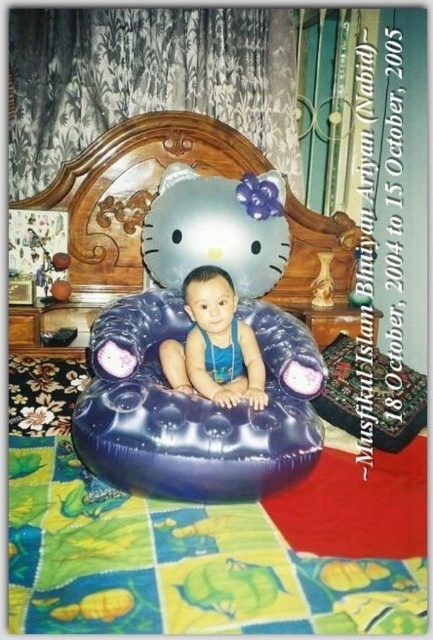
Is blue rubber bean bag chair at center bigger than blue rubber baby at center?

Indeed, blue rubber bean bag chair at center has a larger size compared to blue rubber baby at center.

Can you confirm if blue rubber bean bag chair at center is thinner than blue rubber baby at center?

No.

Between point (306, 436) and point (207, 396), which one is positioned behind?

The point (207, 396) is behind.

Find the location of `blue rubber bean bag chair at center`. blue rubber bean bag chair at center is located at coordinates (194, 406).